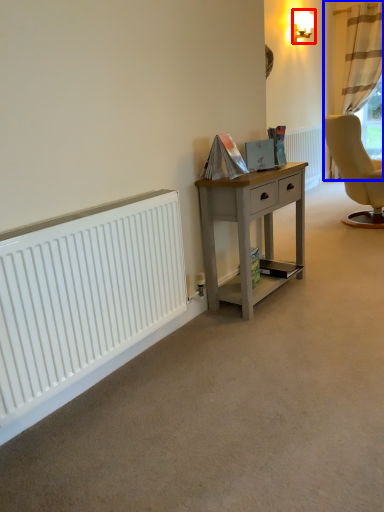
Question: Among these objects, which one is farthest to the camera, lamp (highlighted by a red box) or curtain (highlighted by a blue box)?

Choices:
 (A) lamp
 (B) curtain

Answer: (B)